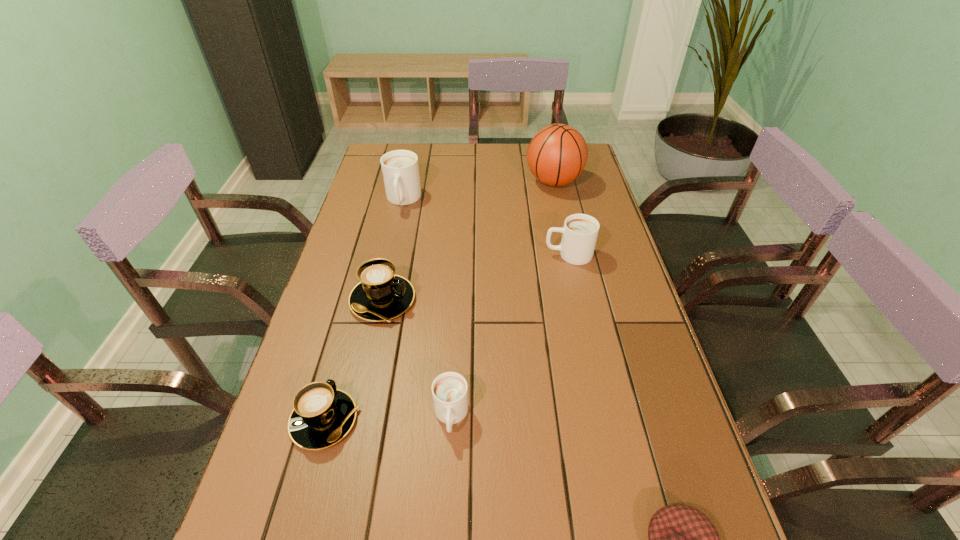
Locate an element on the screen. Image resolution: width=960 pixels, height=540 pixels. cappuccino that stands as the third closest to the second white cappuccino from left to right is located at coordinates (580, 231).

Locate which cappuccino ranks in proximity to the second nearest white cappuccino. Please provide its 2D coordinates. Your answer should be formatted as a tuple, i.e. [(x, y)], where the tuple contains the x and y coordinates of a point satisfying the conditions above.

[(381, 295)]

You are a GUI agent. You are given a task and a screenshot of the screen. Output one action in this format:
    pyautogui.click(x=<x>, y=<y>)
    Task: Click on the white cappuccino that stands as the second closest to the rightmost cappuccino
    The height and width of the screenshot is (540, 960).
    Given the screenshot: What is the action you would take?
    pyautogui.click(x=449, y=390)

Select which white cappuccino is the second closest to the nearest white cappuccino. Please provide its 2D coordinates. Your answer should be formatted as a tuple, i.e. [(x, y)], where the tuple contains the x and y coordinates of a point satisfying the conditions above.

[(400, 169)]

Find the location of a particular element. black cappuccino that is the second closest one to the farthest white cappuccino is located at coordinates (322, 415).

Find the location of a particular element. This screenshot has width=960, height=540. free space that satisfies the following two spatial constraints: 1. on the back side of the basketball; 2. on the right side of the smaller black cappuccino is located at coordinates (390, 182).

Locate an element on the screen. free location that satisfies the following two spatial constraints: 1. on the side with the handle of the second biggest white cappuccino; 2. on the side with the handle of the second cappuccino from right to left is located at coordinates (604, 416).

Locate an element on the screen. This screenshot has width=960, height=540. free space that satisfies the following two spatial constraints: 1. on the side with the handle of the bigger black cappuccino; 2. on the left side of the biggest white cappuccino is located at coordinates (381, 300).